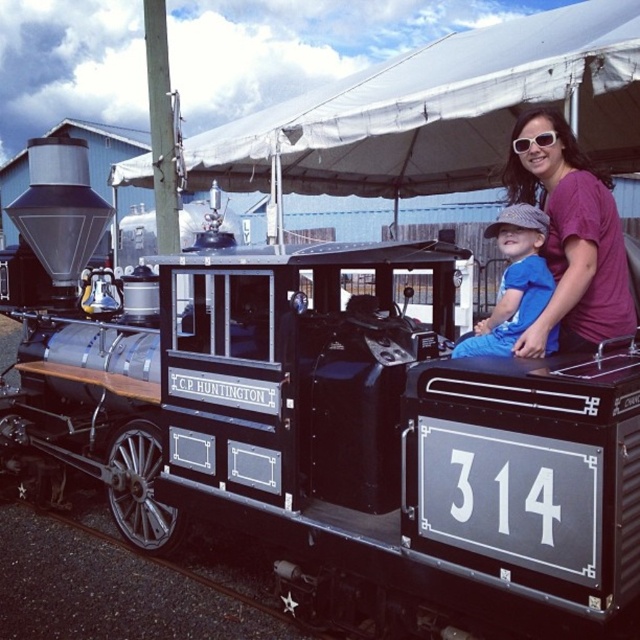
Question: Can you confirm if white fabric canopy at upper center is smaller than sunglasses at upper center?

Choices:
 (A) no
 (B) yes

Answer: (A)

Question: Is purple cotton shirt at upper right smaller than blue cotton shirt at center?

Choices:
 (A) no
 (B) yes

Answer: (A)

Question: Among these points, which one is nearest to the camera?

Choices:
 (A) (605, 29)
 (B) (515, 282)
 (C) (552, 136)

Answer: (B)

Question: Which point is farther from the camera taking this photo?

Choices:
 (A) (534, 339)
 (B) (460, 102)
 (C) (538, 257)
 (D) (541, 134)

Answer: (B)

Question: Observing the image, what is the correct spatial positioning of white fabric canopy at upper center in reference to purple cotton shirt at upper right?

Choices:
 (A) below
 (B) above

Answer: (B)

Question: Among these points, which one is farthest from the camera?

Choices:
 (A) (525, 264)
 (B) (566, 164)
 (C) (529, 145)
 (D) (394, 182)

Answer: (D)